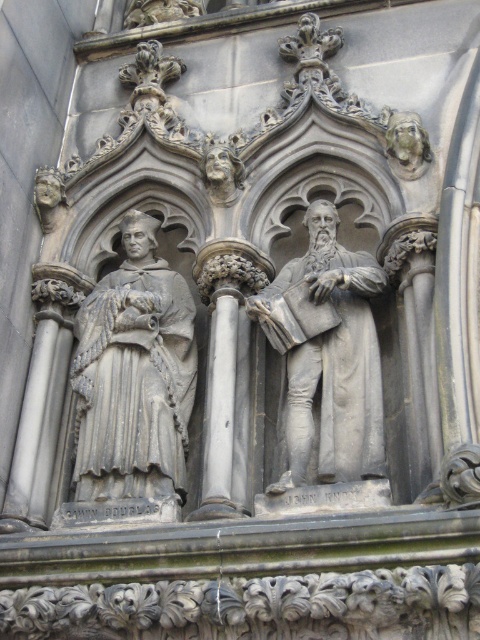
Is point (322, 433) behind point (39, 481)?

That is False.

Can you confirm if gray stone statue at center is positioned below gray stone pillar at left?

Incorrect, gray stone statue at center is not positioned below gray stone pillar at left.

Does point (372, 440) lie in front of point (35, 289)?

Yes.

Where is `gray stone statue at center`? The image size is (480, 640). gray stone statue at center is located at coordinates (326, 356).

Which of these two, gray stone statue at left or gray stone column at center, stands taller?

gray stone statue at left

The height and width of the screenshot is (640, 480). What do you see at coordinates (133, 374) in the screenshot?
I see `gray stone statue at left` at bounding box center [133, 374].

Between point (168, 323) and point (210, 429), which one is positioned in front?

Point (210, 429) is in front.

Image resolution: width=480 pixels, height=640 pixels. Identify the location of gray stone statue at left. (133, 374).

This screenshot has height=640, width=480. What are the coordinates of `gray stone column at center` in the screenshot? It's located at (227, 371).

Is the position of gray stone column at center less distant than that of gray stone pillar at left?

Yes, it is in front of gray stone pillar at left.

Is point (240, 310) positioned after point (63, 317)?

No, (240, 310) is closer to viewer.

Locate an element on the screen. gray stone column at center is located at coordinates (227, 371).